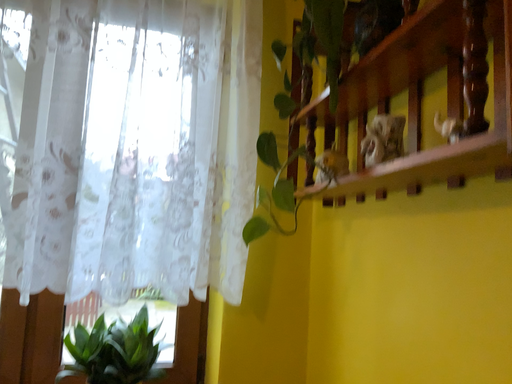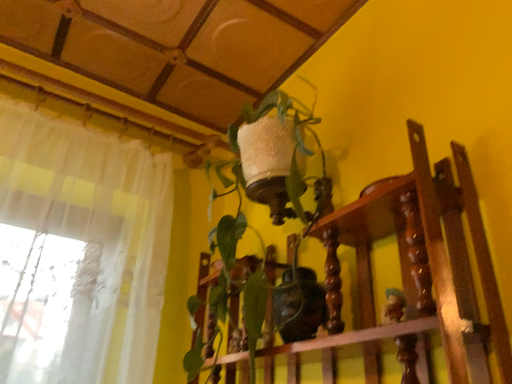
Question: Which way did the camera rotate in the video?

Choices:
 (A) rotated upward
 (B) rotated downward

Answer: (A)